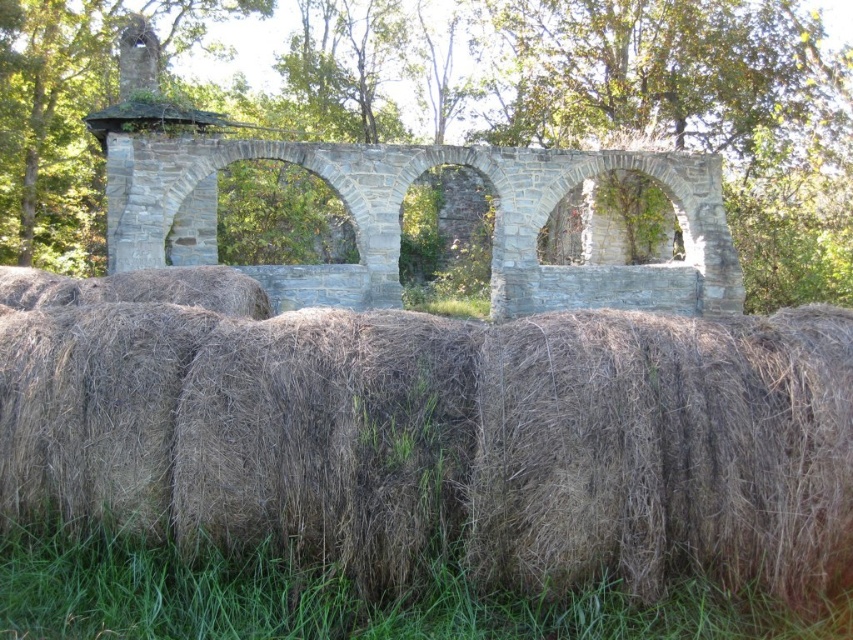
You are standing in front of the rustic stone structure with three arches. You see the brown straw bales at lower center and the dry straw at lower center. Which object is closer to you?

The brown straw bales at lower center are closer to you because they are positioned further to the viewer than the dry straw at lower center.

You are standing in front of the gray stone arches at center and want to take a photo that captures the entire structure. Considering the camera you are using has a standard lens with a focal length of 50mm, what is the minimum distance you should maintain from the arches to ensure they fit entirely within the frame?

The gray stone arches at center are 30.17 meters away from the camera. Since the camera is already positioned at this distance, you can take the photo from here as the 50mm lens should be sufficient to capture the entire structure without needing to move closer.

You are trying to determine if a small delivery robot with a width of 0.5 meters can pass through the space between the brown straw bales at lower center and the gray stone arches at center. Based on the scene description, can the robot fit through that space?

The brown straw bales at lower center are thinner than the gray stone arches at center, so the space between them is wider than the robot. Therefore, the robot can fit through the space between the brown straw bales at lower center and the gray stone arches at center.